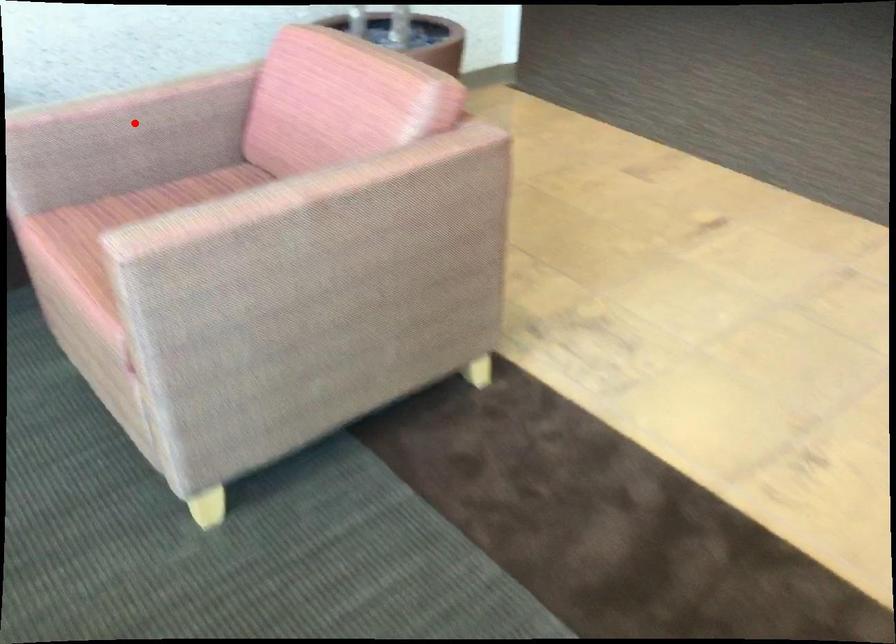
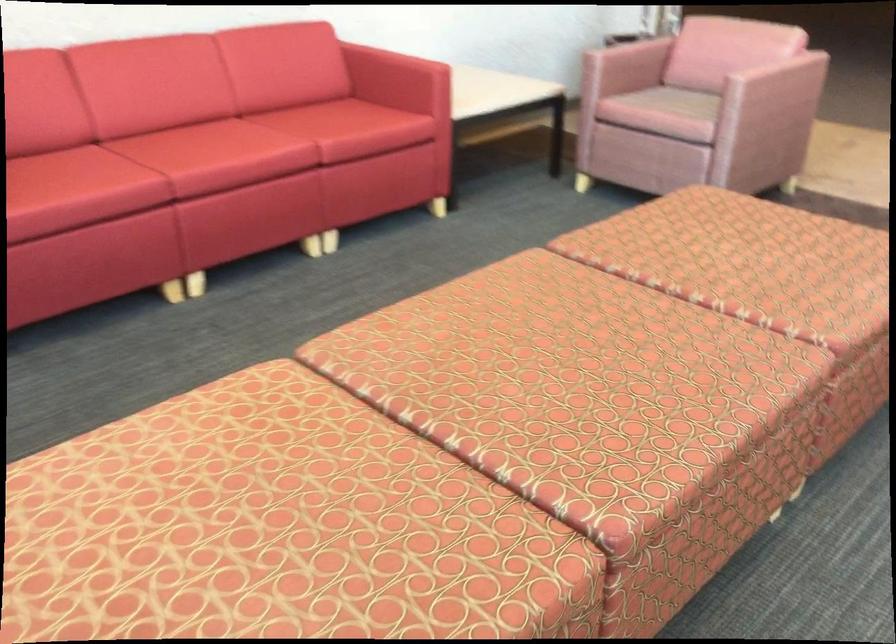
Question: I am providing you with two images of the same scene from different viewpoints. Image1 has a red point marked. In image2, the corresponding 3D location appears at what relative position? Reply with the corresponding letter.

Choices:
 (A) Closer
 (B) Farther

Answer: (B)